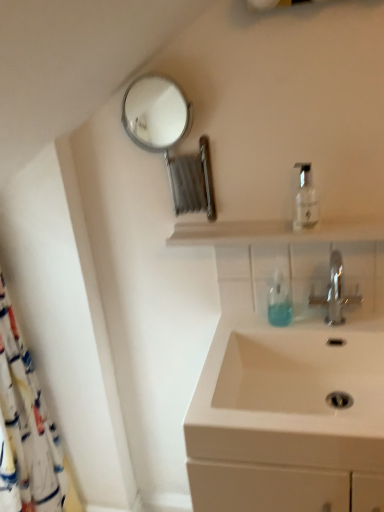
Where is `free space that is to the left of translucent plastic soap dispenser at center`? free space that is to the left of translucent plastic soap dispenser at center is located at coordinates (246, 325).